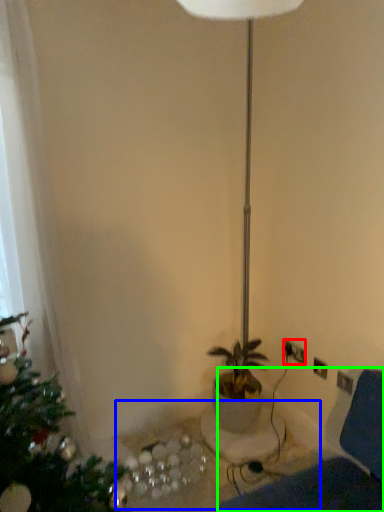
Question: Which object is the farthest from electric outlet (highlighted by a red box)? Choose among these: table (highlighted by a blue box) or swivel chair (highlighted by a green box).

Choices:
 (A) table
 (B) swivel chair

Answer: (B)